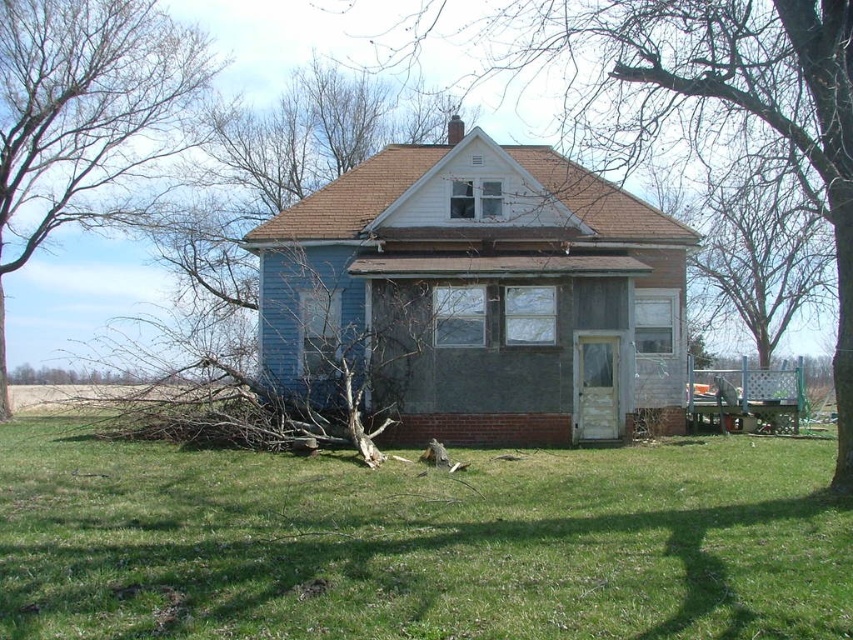
Which of these two, green grass at lower center or bare branches at left, stands taller?

bare branches at left

Is green grass at lower center smaller than bare branches at left?

A: Yes, green grass at lower center is smaller than bare branches at left.

I want to click on green grass at lower center, so click(x=418, y=544).

This screenshot has width=853, height=640. Identify the location of green grass at lower center. (418, 544).

Which is in front, point (584, 26) or point (83, 173)?

Point (584, 26)

Does point (556, 22) come behind point (151, 40)?

That is True.

Measure the distance between point (631, 17) and camera.

Point (631, 17) is 44.75 feet away from camera.

Find the location of `gray bark tree at center`. gray bark tree at center is located at coordinates (718, 99).

Is point (780, 506) positioned behind point (625, 113)?

That is False.

Image resolution: width=853 pixels, height=640 pixels. Find the location of `green grass at lower center`. green grass at lower center is located at coordinates (418, 544).

Is point (288, 596) positioned in front of point (849, 195)?

Yes, it is in front of point (849, 195).

Find the location of a particular element. The height and width of the screenshot is (640, 853). green grass at lower center is located at coordinates (418, 544).